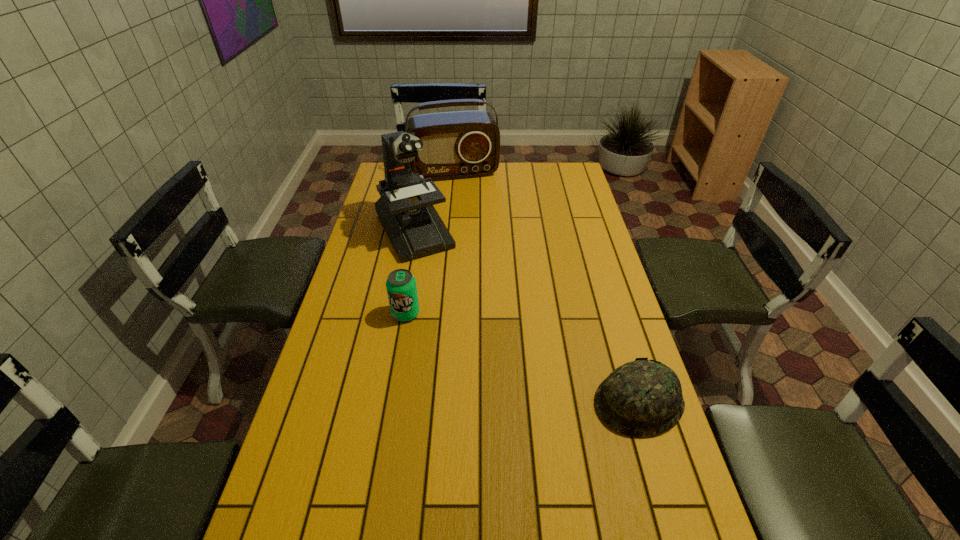
Where is `object positioned at the far left corner`? The image size is (960, 540). object positioned at the far left corner is located at coordinates (462, 144).

Image resolution: width=960 pixels, height=540 pixels. Find the location of `free space at the far edge`. free space at the far edge is located at coordinates (503, 180).

This screenshot has height=540, width=960. Find the location of `free space at the left edge of the desktop`. free space at the left edge of the desktop is located at coordinates (320, 452).

This screenshot has height=540, width=960. Find the location of `free location at the far left corner`. free location at the far left corner is located at coordinates (384, 166).

Where is `vacant space at the far right corner`? vacant space at the far right corner is located at coordinates (553, 179).

I want to click on vacant area at the near right corner of the desktop, so click(662, 528).

Where is `blank region between the nearest object and the pop soda`? blank region between the nearest object and the pop soda is located at coordinates (522, 358).

The height and width of the screenshot is (540, 960). In order to click on empty space between the radio receiver and the headwear in this screenshot , I will do pos(546,287).

The width and height of the screenshot is (960, 540). In order to click on empty space between the second tallest object and the nearest object in this screenshot , I will do `click(546, 287)`.

You are a GUI agent. You are given a task and a screenshot of the screen. Output one action in this format:
    pyautogui.click(x=<x>, y=<y>)
    Task: Click on the empty location between the second farthest object and the shortest object
    This screenshot has height=540, width=960.
    Given the screenshot: What is the action you would take?
    pyautogui.click(x=526, y=316)